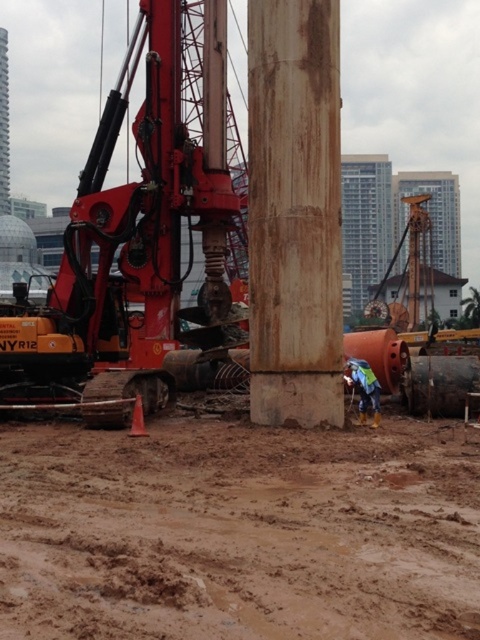
Question: Which point is farther to the camera?

Choices:
 (A) (357, 465)
 (B) (282, 253)

Answer: (B)

Question: Which object is farther from the camera taking this photo?

Choices:
 (A) blue reflective safety vest at lower right
 (B) rusty metal pole at center
 (C) brown dirt at lower center
 (D) matte orange excavator at left

Answer: (D)

Question: Does matte orange excavator at left appear on the left side of rusty metal pole at center?

Choices:
 (A) no
 (B) yes

Answer: (B)

Question: Does brown dirt at lower center have a smaller size compared to rusty metal pole at center?

Choices:
 (A) no
 (B) yes

Answer: (A)

Question: Which object is positioned closest to the rusty metal pole at center?

Choices:
 (A) blue reflective safety vest at lower right
 (B) matte orange excavator at left
 (C) brown dirt at lower center

Answer: (A)

Question: Is rusty metal pole at center to the right of blue reflective safety vest at lower right from the viewer's perspective?

Choices:
 (A) yes
 (B) no

Answer: (B)